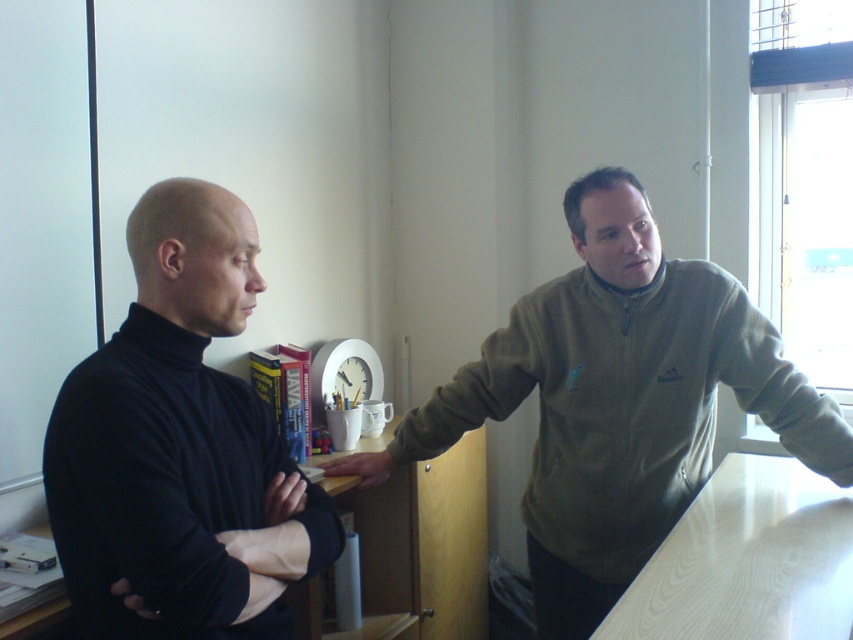
Question: Does olive-green fleece at right appear under black matte hand at lower left?

Choices:
 (A) no
 (B) yes

Answer: (A)

Question: Which of the following is the closest to the observer?

Choices:
 (A) (325, 468)
 (B) (202, 296)
 (C) (643, 406)

Answer: (B)

Question: Which object is positioned closest to the black turtleneck sweater at left?

Choices:
 (A) black matte hand at lower left
 (B) olive-green fleece at right

Answer: (A)

Question: Can you confirm if matte black hand at center is bigger than black matte hand at lower left?

Choices:
 (A) yes
 (B) no

Answer: (A)

Question: Which of the following is the closest to the observer?

Choices:
 (A) (575, 273)
 (B) (154, 609)
 (C) (288, 476)
 (D) (375, 477)

Answer: (B)

Question: Can you confirm if matte black hand at center is smaller than black matte hand at lower left?

Choices:
 (A) yes
 (B) no

Answer: (B)